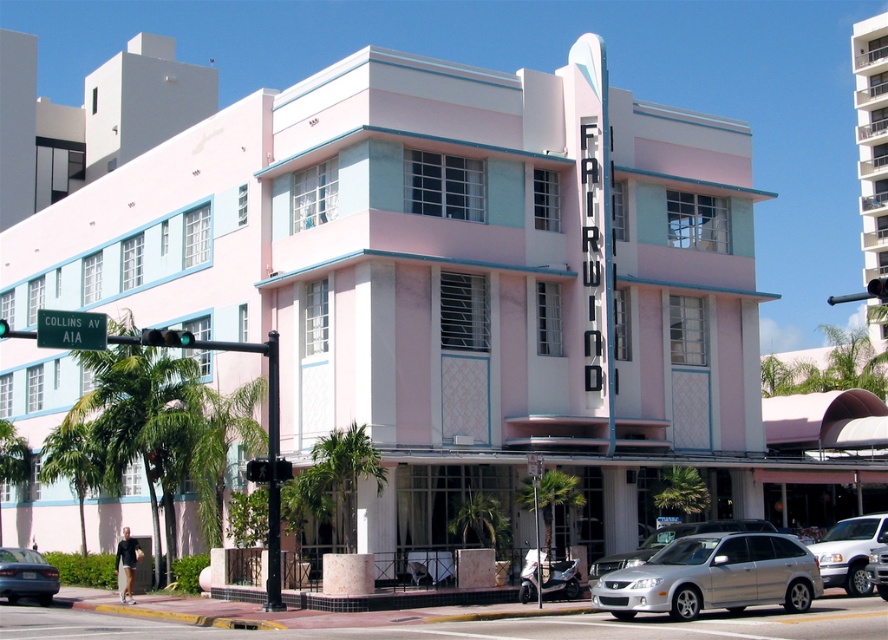
What do you see at coordinates (871, 138) in the screenshot? I see `white concrete building at upper right` at bounding box center [871, 138].

Does point (886, 100) come farther from viewer compared to point (0, 332)?

Yes, it is.

Measure the distance between white concrete building at upper right and camera.

62.69 meters

Identify the location of white concrete building at upper right. (871, 138).

Which is behind, point (36, 561) or point (2, 320)?

Point (2, 320)

Who is positioned more to the right, matte silver sedan at lower left or green glass traffic light at upper left?

matte silver sedan at lower left is more to the right.

Which is in front, point (33, 570) or point (2, 321)?

Point (2, 321)

Find the location of `matte silver sedan at lower left`. matte silver sedan at lower left is located at coordinates (26, 576).

Is point (2, 593) in front of point (666, 500)?

Yes, it is in front of point (666, 500).

Describe the element at coordinates (26, 576) in the screenshot. I see `matte silver sedan at lower left` at that location.

Between point (20, 564) and point (683, 502), which one is positioned behind?

Point (683, 502)

In order to click on matte silver sedan at lower left in this screenshot , I will do [26, 576].